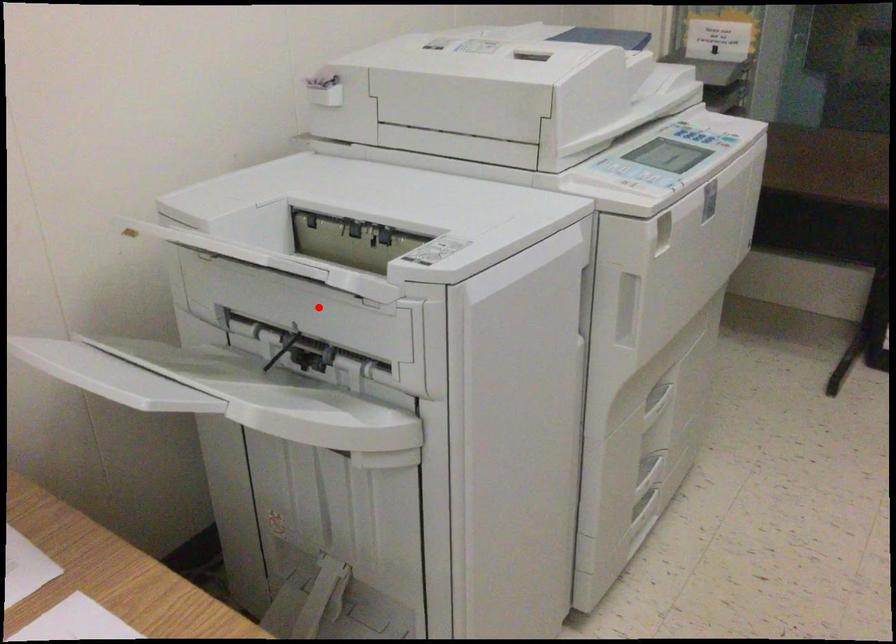
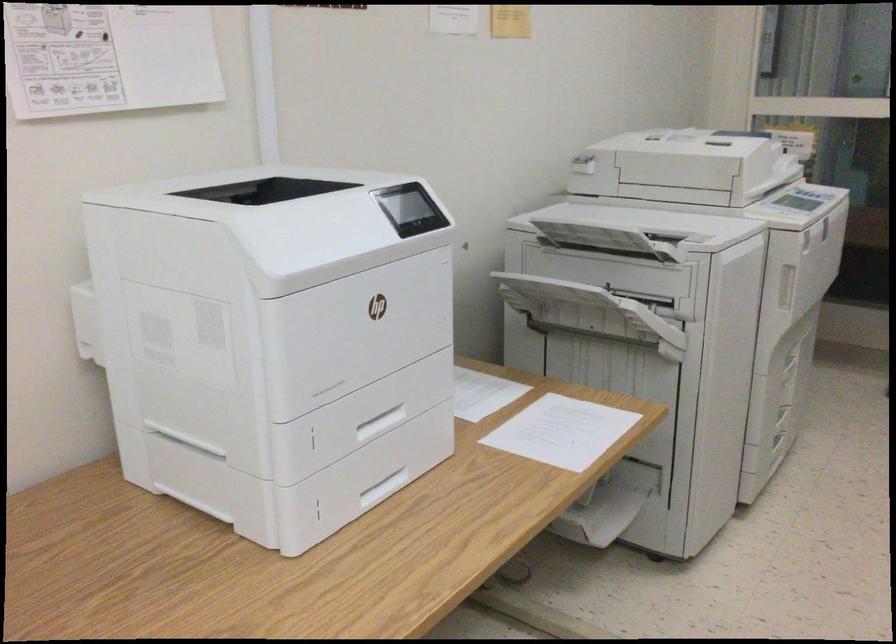
Question: I am providing you with two images of the same scene from different viewpoints. Given a red point in image1, look at the same physical point in image2. Is it:

Choices:
 (A) Closer to the viewpoint
 (B) Farther from the viewpoint

Answer: (B)